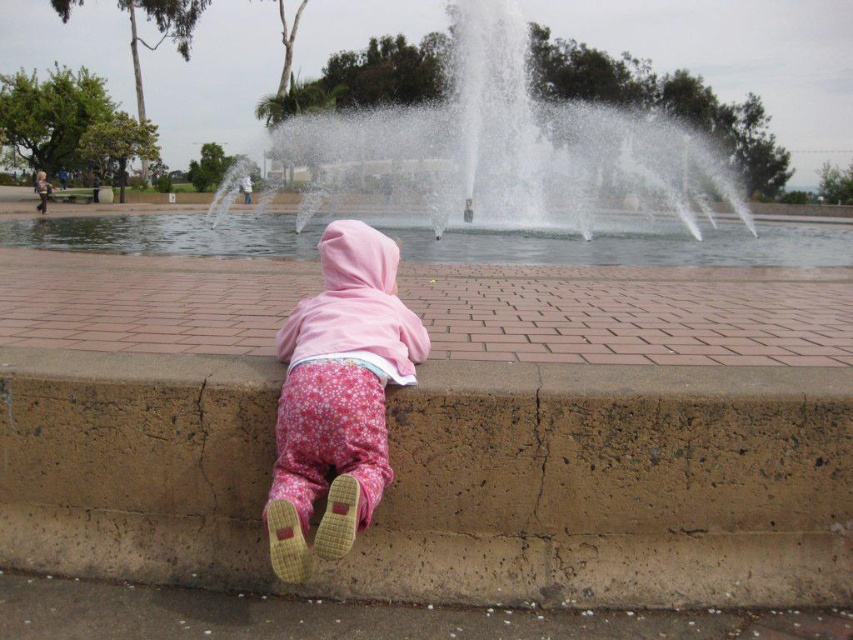
You are a photographer trying to capture the child in the pink fleece jacket at center without the white water at center obstructing the view. Is the water blocking the jacket in the image?

The white water at center is above the pink fleece jacket at center, so it may be obstructing the jacket in the image depending on the angle and positioning.

You are a delivery robot with a 1.5 meter wide package. You need to move from the brown concrete curb at lower center to the white water at center. Can you safely navigate the path between them without hitting the package?

The distance between the brown concrete curb at lower center and the white water at center is 29.12 meters. Since the package is only 1.5 meters wide, the robot can safely navigate the path as the distance is sufficient to maneuver around the package without obstruction.

You are a photographer wanting to capture the child in the pink fleece jacket at center without the white water at center obstructing the view. Based on the scene, can you position yourself in a way to achieve this?

The pink fleece jacket at center is behind the white water at center, so you cannot position yourself to capture the child without the white water obstructing the view.